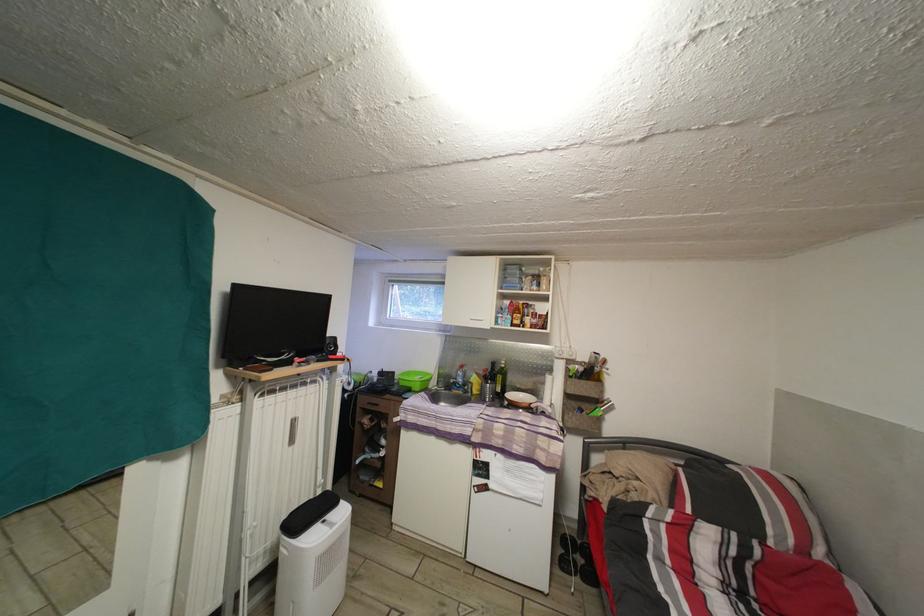
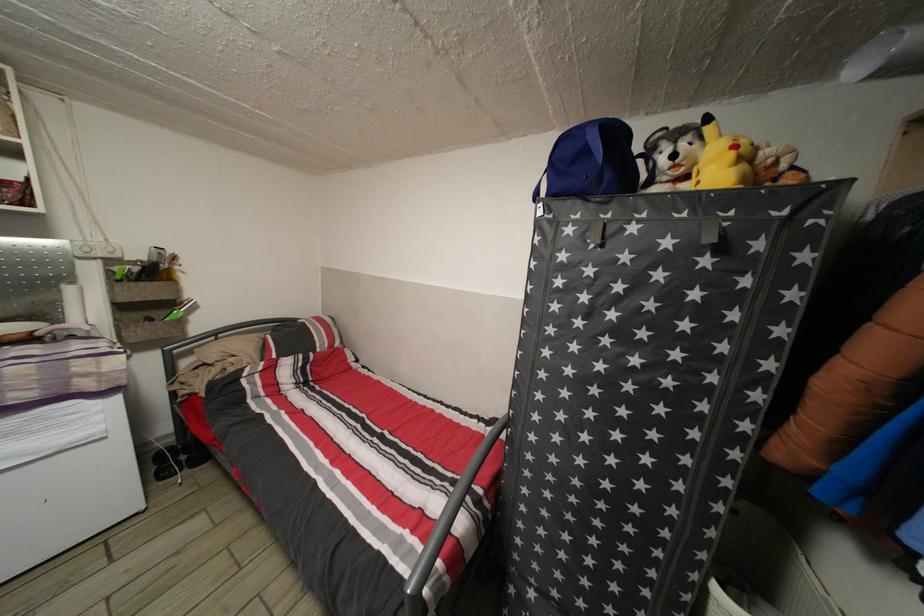
The point at (x=598, y=390) is marked in the first image. Where is the corresponding point in the second image?

(164, 291)